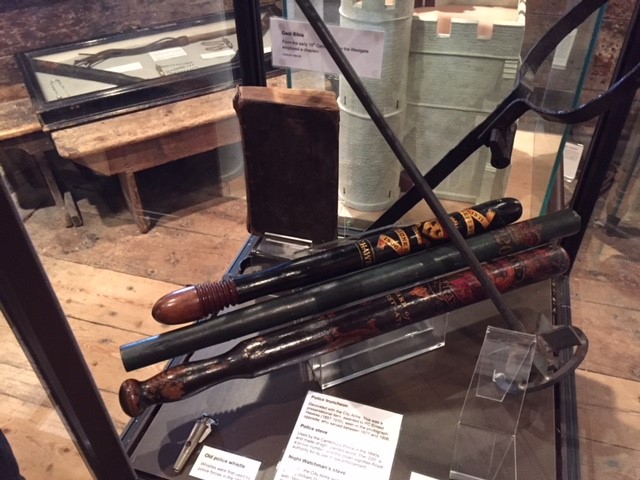
What are the coordinates of `glass` in the screenshot? It's located at (409, 96), (154, 62), (68, 89).